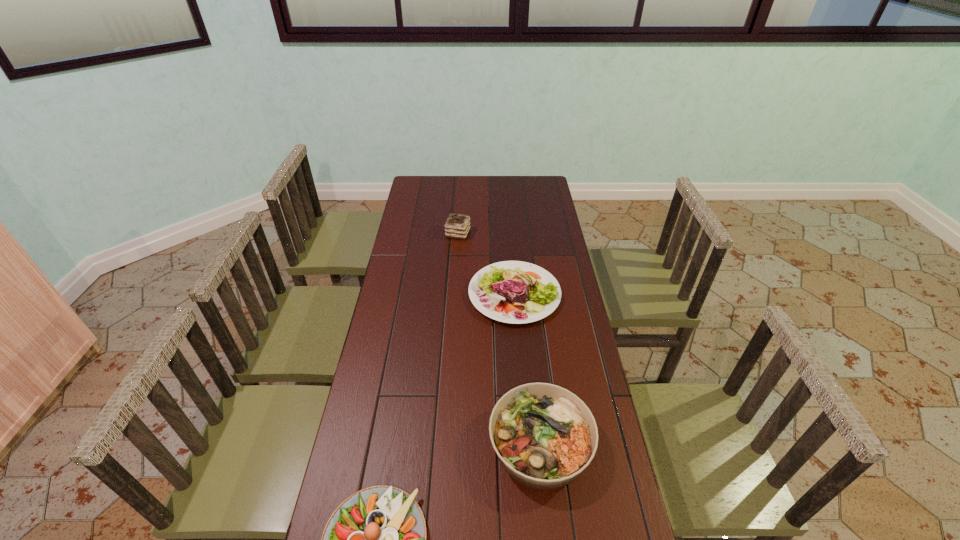
I want to click on the farthest object, so click(457, 226).

This screenshot has height=540, width=960. In order to click on the third nearest object in this screenshot , I will do `click(517, 292)`.

Where is `blank space located 0.370m on the front of the chocolate cake`? blank space located 0.370m on the front of the chocolate cake is located at coordinates (454, 298).

Identify the location of vacant space located on the front of the second farthest object. The height and width of the screenshot is (540, 960). [x=525, y=415].

The height and width of the screenshot is (540, 960). What are the coordinates of `vacant space at the far edge of the desktop` in the screenshot? It's located at (461, 190).

Where is `free space at the left edge of the desktop`? The width and height of the screenshot is (960, 540). free space at the left edge of the desktop is located at coordinates (416, 204).

This screenshot has height=540, width=960. I want to click on vacant region at the right edge, so click(562, 252).

Locate an element on the screen. The height and width of the screenshot is (540, 960). vacant space at the far left corner is located at coordinates (439, 184).

Image resolution: width=960 pixels, height=540 pixels. What are the coordinates of `free space between the farthest salad plate and the chocolate cake` in the screenshot? It's located at (486, 264).

This screenshot has width=960, height=540. Find the location of `object that can be found as the closest to the third nearest object`. object that can be found as the closest to the third nearest object is located at coordinates (457, 226).